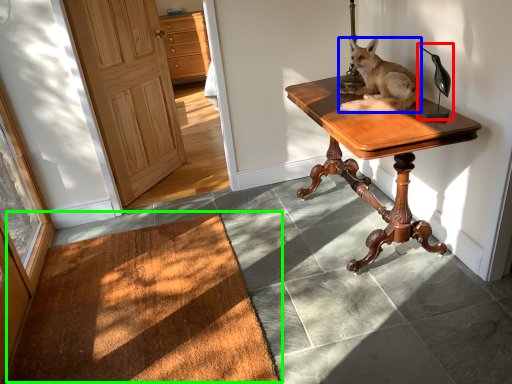
Question: Based on their relative distances, which object is farther from table lamp (highlighted by a red box)? Choose from dog (highlighted by a blue box) and doormat (highlighted by a green box).

Choices:
 (A) dog
 (B) doormat

Answer: (B)